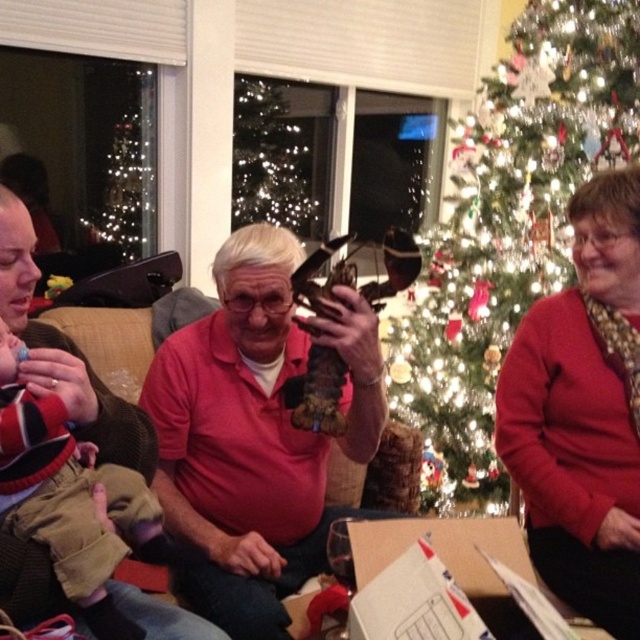
Question: Is iridescent glass ornaments at center to the right of matte pink shirt at center from the viewer's perspective?

Choices:
 (A) yes
 (B) no

Answer: (A)

Question: Which object is positioned closest to the knit red and black sweater at lower left?

Choices:
 (A) matte pink shirt at center
 (B) red sweater at right

Answer: (A)

Question: Which object is farther from the camera taking this photo?

Choices:
 (A) iridescent glass ornaments at center
 (B) red sweater at right
 (C) matte pink shirt at center
 (D) knit red and black sweater at lower left

Answer: (A)

Question: Can you confirm if iridescent glass ornaments at center is wider than knit red and black sweater at lower left?

Choices:
 (A) yes
 (B) no

Answer: (A)

Question: Which object is closer to the camera taking this photo?

Choices:
 (A) matte pink shirt at center
 (B) knit red and black sweater at lower left
 (C) red sweater at right

Answer: (B)

Question: Is red sweater at right smaller than knit red and black sweater at lower left?

Choices:
 (A) yes
 (B) no

Answer: (B)